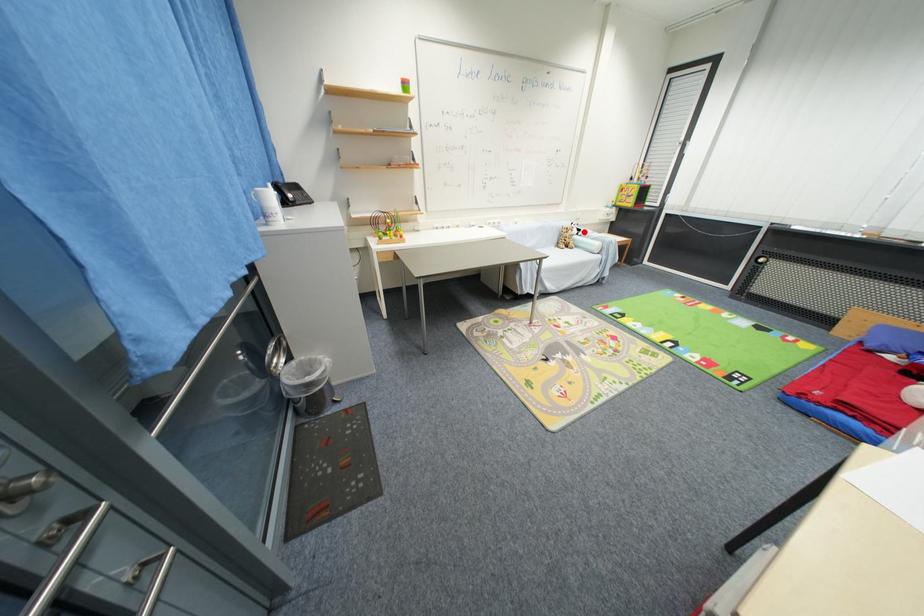
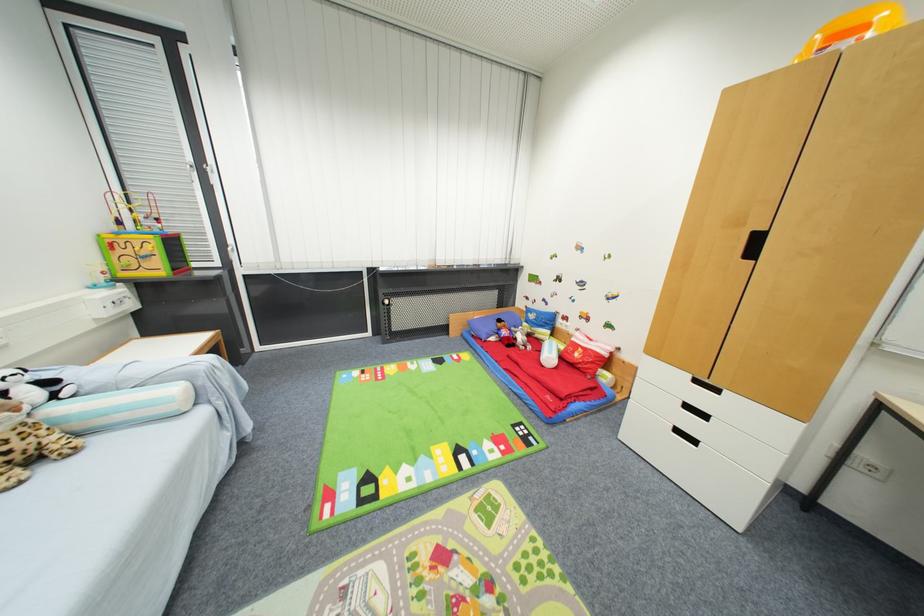
Question: I am providing you with two images of the same scene from different viewpoints. Given a red point in image1, look at the same physical point in image2. Is it:

Choices:
 (A) Closer to the viewpoint
 (B) Farther from the viewpoint

Answer: (B)